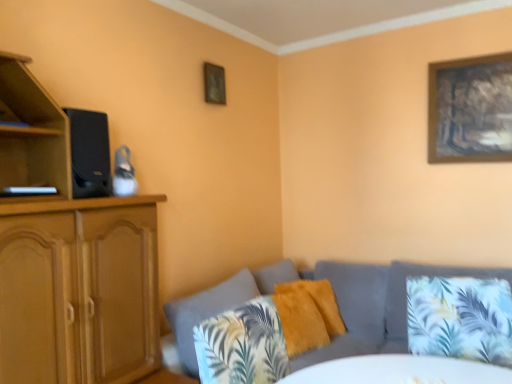
This screenshot has height=384, width=512. Find the location of `empty space that is ontop of wooden framed artwork at upper right, arranged as the second picture frame when viewed from the left`. empty space that is ontop of wooden framed artwork at upper right, arranged as the second picture frame when viewed from the left is located at coordinates (467, 59).